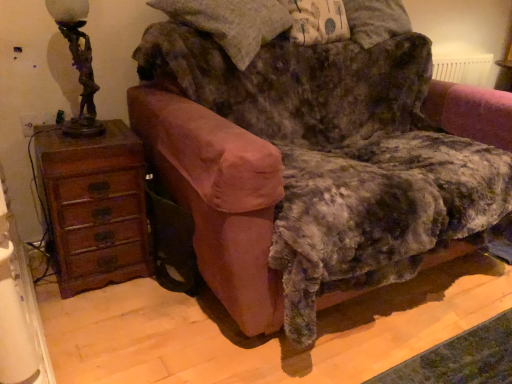
Question: In terms of size, does velvet pink armchair at center appear bigger or smaller than bronze statue-like at left?

Choices:
 (A) small
 (B) big

Answer: (B)

Question: In the image, is velvet pink armchair at center on the left side or the right side of bronze statue-like at left?

Choices:
 (A) left
 (B) right

Answer: (B)

Question: Which is nearer to the bronze statue-like at left?

Choices:
 (A) velvet pink armchair at center
 (B) brown wooden chest of drawers at left

Answer: (B)

Question: Which object is positioned closest to the brown wooden chest of drawers at left?

Choices:
 (A) bronze statue-like at left
 (B) velvet pink armchair at center

Answer: (A)